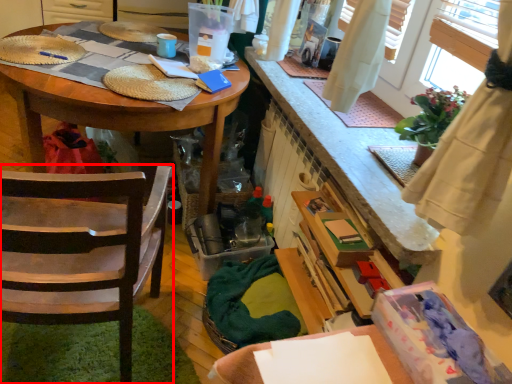
Question: From the image, what is the correct spatial relationship of chair (annotated by the red box) in relation to desk?

Choices:
 (A) left
 (B) right

Answer: (B)